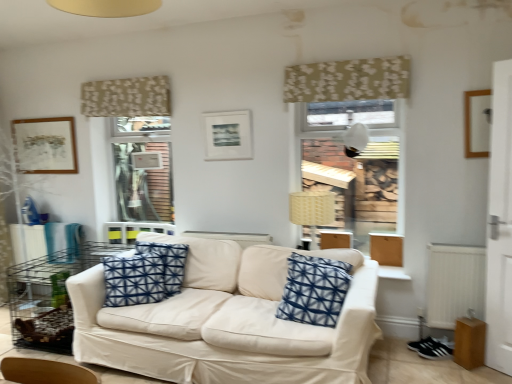
This screenshot has height=384, width=512. Find the location of `vacant space situated above beige floral fabric at upper center, arranged as the 1th curtain when viewed from the right (from a real-world perspective)`. vacant space situated above beige floral fabric at upper center, arranged as the 1th curtain when viewed from the right (from a real-world perspective) is located at coordinates (340, 59).